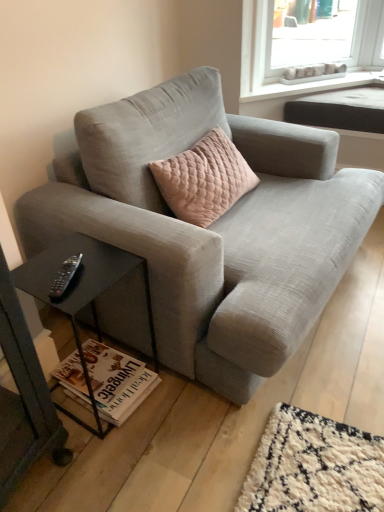
This screenshot has width=384, height=512. I want to click on vacant space to the right of black glass table at lower left, so click(173, 409).